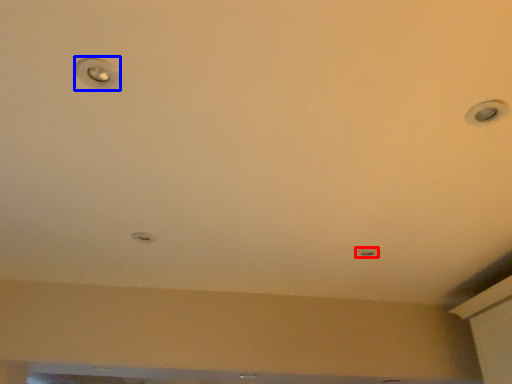
Question: Which point is further to the camera, light (highlighted by a red box) or droplight (highlighted by a blue box)?

Choices:
 (A) light
 (B) droplight

Answer: (A)